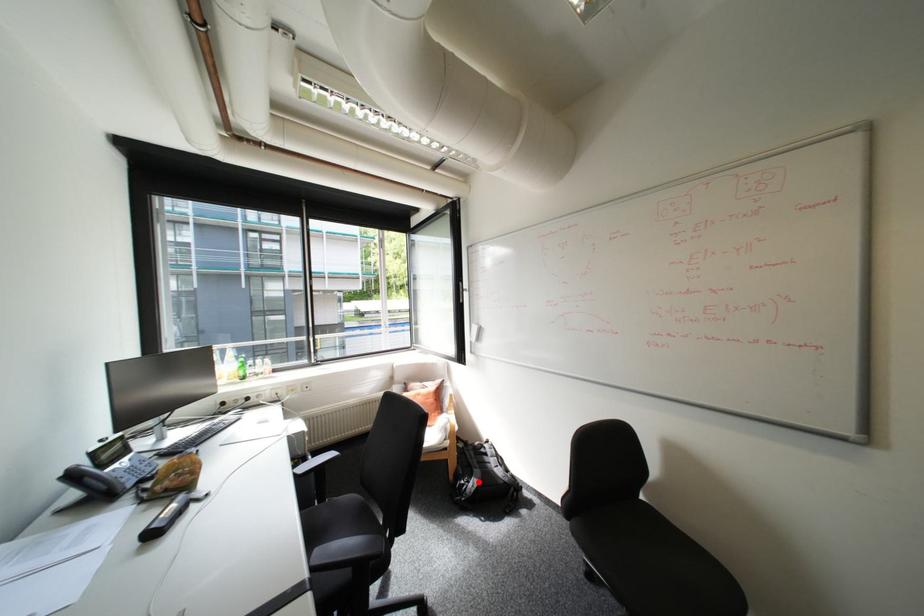
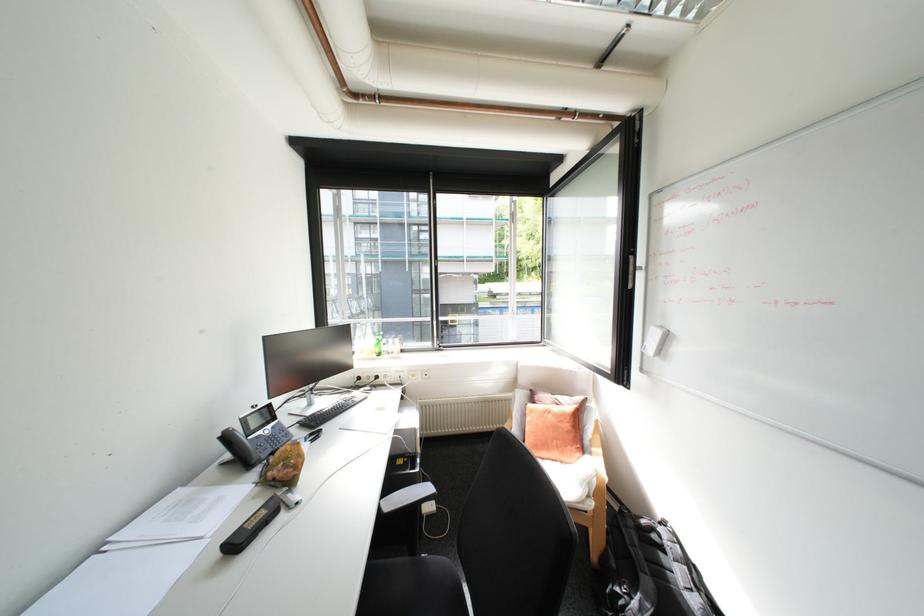
The point at the highlighted location is marked in the first image. Where is the corresponding point in the second image?

(640, 598)